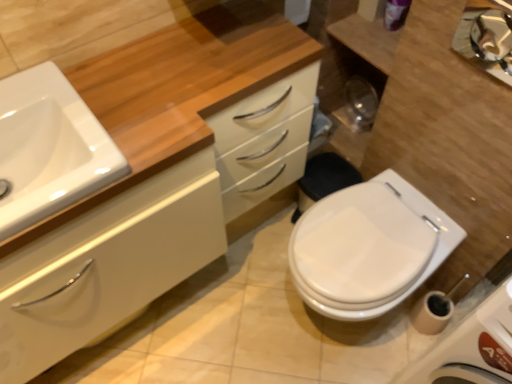
What do you see at coordinates (487, 37) in the screenshot? I see `metallic reflective mirror at upper right` at bounding box center [487, 37].

What is the approximate height of white glossy toilet at lower right?

The height of white glossy toilet at lower right is 33.78 inches.

Identify the location of white glossy toilet at lower right. (369, 247).

Where is `white glossy cabinet at center`? This screenshot has width=512, height=384. white glossy cabinet at center is located at coordinates (157, 176).

Would you say metallic reflective mirror at upper right is a long distance from white glossy toilet at lower right?

No.

Does point (503, 5) come farther from viewer compared to point (507, 286)?

Yes, point (503, 5) is farther from viewer.

Is metallic reflective mirror at upper right positioned with its back to white glossy toilet at lower right?

No, metallic reflective mirror at upper right is not facing away from white glossy toilet at lower right.

The width and height of the screenshot is (512, 384). Identify the location of mirror above the white glossy toilet at lower right (from the image's perspective). (487, 37).

Considering the relative sizes of white glossy cabinet at center and white glossy sink at left in the image provided, is white glossy cabinet at center bigger than white glossy sink at left?

Correct, white glossy cabinet at center is larger in size than white glossy sink at left.

Is white glossy cabinet at center taller than white glossy sink at left?

Correct, white glossy cabinet at center is much taller as white glossy sink at left.

From the image's perspective, is white glossy cabinet at center under white glossy sink at left?

Yes.

Would you say white glossy cabinet at center is outside white glossy toilet at lower right?

white glossy cabinet at center is positioned outside white glossy toilet at lower right.

Is point (193, 265) closer to camera compared to point (353, 284)?

No, it is not.

From a real-world perspective, which object stands above the other?

From a 3D spatial view, white glossy cabinet at center is above.

Measure the distance from white glossy cabinet at center to white glossy toilet at lower right.

white glossy cabinet at center and white glossy toilet at lower right are 17.35 inches apart from each other.

Considering the sizes of objects white glossy toilet at lower right and white glossy toilet at lower right in the image provided, who is bigger, white glossy toilet at lower right or white glossy toilet at lower right?

With larger size is white glossy toilet at lower right.

How different are the orientations of white glossy toilet at lower right and white glossy toilet at lower right in degrees?

1.3 degrees.

Which is nearer, (319,294) or (495,339)?

Point (319,294) is farther from the camera than point (495,339).

Is white glossy toilet at lower right positioned with its back to white glossy toilet at lower right?

No, white glossy toilet at lower right is not facing away from white glossy toilet at lower right.

Which is correct: white glossy sink at left is inside white glossy cabinet at center, or outside of it?

white glossy sink at left is located inside white glossy cabinet at center.

Is white glossy sink at left positioned before white glossy cabinet at center?

No, white glossy sink at left is behind white glossy cabinet at center.

Is white glossy sink at left oriented away from white glossy cabinet at center?

Yes, white glossy cabinet at center is at the back of white glossy sink at left.

Considering the sizes of white glossy sink at left and white glossy cabinet at center in the image, is white glossy sink at left wider or thinner than white glossy cabinet at center?

Clearly, white glossy sink at left has less width compared to white glossy cabinet at center.

Is white glossy toilet at lower right taller or shorter than metallic reflective mirror at upper right?

white glossy toilet at lower right is taller than metallic reflective mirror at upper right.

Does white glossy toilet at lower right have a greater width compared to metallic reflective mirror at upper right?

Yes, white glossy toilet at lower right is wider than metallic reflective mirror at upper right.

From a real-world perspective, which is physically above, white glossy toilet at lower right or metallic reflective mirror at upper right?

From a 3D spatial view, metallic reflective mirror at upper right is above.

Looking at this image, how different are the orientations of white glossy toilet at lower right and metallic reflective mirror at upper right in degrees?

The facing directions of white glossy toilet at lower right and metallic reflective mirror at upper right are 2.66 degrees apart.

Is metallic reflective mirror at upper right to the left of white glossy toilet at lower right from the viewer's perspective?

In fact, metallic reflective mirror at upper right is to the right of white glossy toilet at lower right.

Relative to white glossy toilet at lower right, is metallic reflective mirror at upper right in front or behind?

Visually, metallic reflective mirror at upper right is located in front of white glossy toilet at lower right.

From the image's perspective, is metallic reflective mirror at upper right above or below white glossy toilet at lower right?

From the image's perspective, metallic reflective mirror at upper right appears above white glossy toilet at lower right.

Considering the positions of point (506, 31) and point (364, 291), is point (506, 31) closer or farther from the camera than point (364, 291)?

Point (506, 31) is positioned closer to the camera compared to point (364, 291).

Locate an element on the screen. mirror above the white glossy toilet at lower right (from a real-world perspective) is located at coordinates (487, 37).

At what (x,y) coordinates should I click in order to perform the action: click on bathroom cabinet in front of the white glossy sink at left. Please return your answer as a coordinate pair (x, y). Looking at the image, I should click on (157, 176).

When comparing their distances from white glossy sink at left, does metallic reflective mirror at upper right or white glossy toilet at lower right seem further?

metallic reflective mirror at upper right lies further to white glossy sink at left than the other object.

From the image, which object appears to be farther from metallic reflective mirror at upper right, white glossy cabinet at center or white glossy toilet at lower right?

Among the two, white glossy cabinet at center is located further to metallic reflective mirror at upper right.

When comparing their distances from white glossy toilet at lower right, does white glossy toilet at lower right or white glossy sink at left seem further?

The object further to white glossy toilet at lower right is white glossy sink at left.

Based on their spatial positions, is metallic reflective mirror at upper right or white glossy sink at left further from white glossy toilet at lower right?

Based on the image, white glossy sink at left appears to be further to white glossy toilet at lower right.

Which object lies nearer to the anchor point white glossy toilet at lower right, white glossy toilet at lower right or metallic reflective mirror at upper right?

white glossy toilet at lower right is positioned closer to the anchor white glossy toilet at lower right.

Looking at the image, which one is located closer to white glossy toilet at lower right, white glossy cabinet at center or white glossy sink at left?

white glossy cabinet at center.

When comparing their distances from white glossy cabinet at center, does white glossy sink at left or white glossy toilet at lower right seem further?

Among the two, white glossy toilet at lower right is located further to white glossy cabinet at center.

Which object lies nearer to the anchor point white glossy cabinet at center, white glossy toilet at lower right or metallic reflective mirror at upper right?

metallic reflective mirror at upper right is closer to white glossy cabinet at center.

This screenshot has height=384, width=512. What are the coordinates of `toilet between white glossy sink at left and white glossy toilet at lower right from left to right` in the screenshot? It's located at (369, 247).

This screenshot has height=384, width=512. Find the location of `toilet between white glossy sink at left and metallic reflective mirror at upper right in the horizontal direction`. toilet between white glossy sink at left and metallic reflective mirror at upper right in the horizontal direction is located at coordinates click(x=369, y=247).

Where is `toilet between white glossy cabinet at center and white glossy toilet at lower right`? Image resolution: width=512 pixels, height=384 pixels. toilet between white glossy cabinet at center and white glossy toilet at lower right is located at coordinates (369, 247).

I want to click on mirror situated between white glossy cabinet at center and white glossy toilet at lower right from left to right, so click(487, 37).